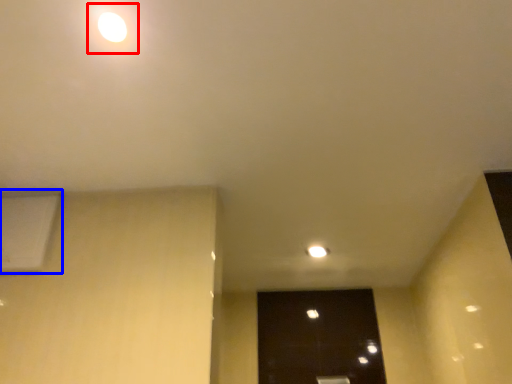
Question: Among these objects, which one is farthest to the camera, light (highlighted by a red box) or air conditioning (highlighted by a blue box)?

Choices:
 (A) light
 (B) air conditioning

Answer: (B)